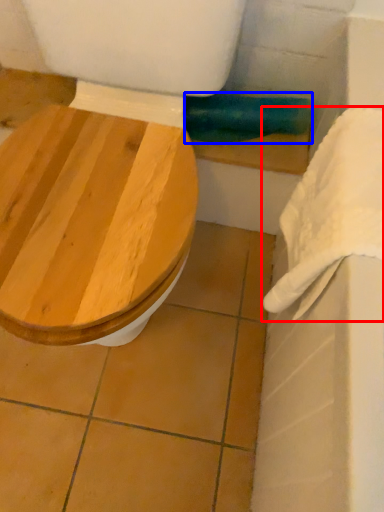
Question: Which point is closer to the camera, towel/napkin (highlighted by a red box) or towel bar (highlighted by a blue box)?

Choices:
 (A) towel/napkin
 (B) towel bar

Answer: (A)